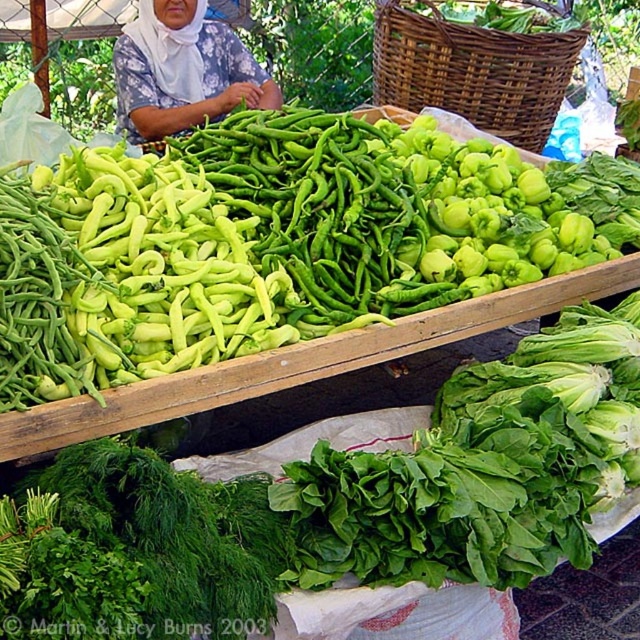
Looking at this image, you are a customer at the market and want to pick up the white cloth headscarf at upper center. Can you reach it without moving the woven brown basket at upper center?

The woven brown basket at upper center is positioned over the white cloth headscarf at upper center, so you cannot reach the white cloth headscarf at upper center without moving the woven brown basket at upper center.

You are a vendor at the market and need to place a 36 inch long measuring tape between the woven brown basket at upper center and the white cloth headscarf at upper center. Can the measuring tape fit between them without bending?

The distance between the woven brown basket at upper center and the white cloth headscarf at upper center is 37.92 inches, which is greater than the 36 inch measuring tape. Therefore, the measuring tape can fit between them without bending.